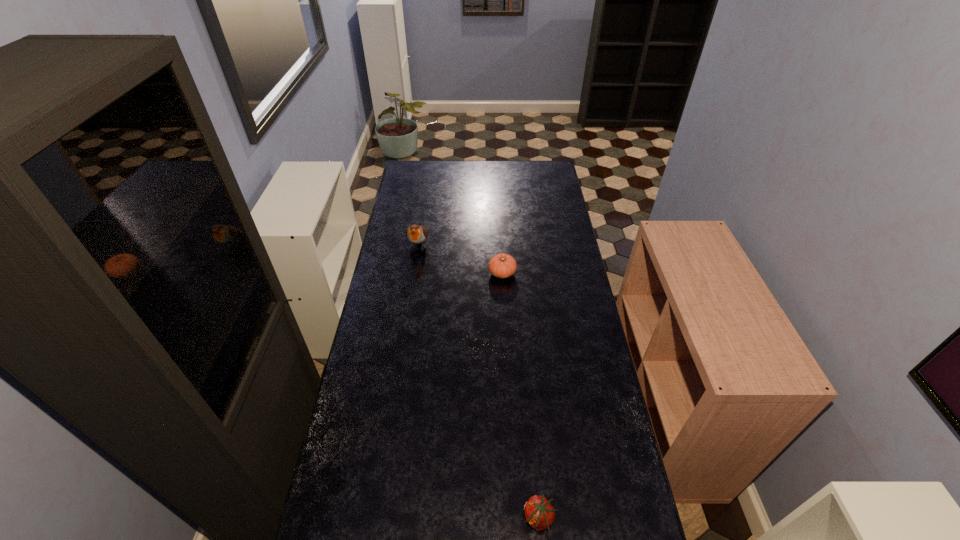
Identify the location of vacant area that lies between the second tallest object and the tallest object. The height and width of the screenshot is (540, 960). pos(461,259).

Where is `empty space between the nearest object and the taller tomato`? This screenshot has width=960, height=540. empty space between the nearest object and the taller tomato is located at coordinates (520, 396).

The width and height of the screenshot is (960, 540). I want to click on free point between the shorter tomato and the second tallest object, so [520, 396].

I want to click on object that is the closest to the farther tomato, so click(416, 234).

You are a GUI agent. You are given a task and a screenshot of the screen. Output one action in this format:
    pyautogui.click(x=<x>, y=<y>)
    Task: Click on the object that is the closest to the tallest object
    
    Given the screenshot: What is the action you would take?
    pyautogui.click(x=502, y=265)

Where is `vacant region that satisfies the following two spatial constraints: 1. at the face of the farthest object; 2. on the left side of the nearer tomato`? The width and height of the screenshot is (960, 540). vacant region that satisfies the following two spatial constraints: 1. at the face of the farthest object; 2. on the left side of the nearer tomato is located at coordinates (376, 518).

Find the location of `vacant space that satisfies the following two spatial constraints: 1. at the face of the bird; 2. on the left side of the farther tomato`. vacant space that satisfies the following two spatial constraints: 1. at the face of the bird; 2. on the left side of the farther tomato is located at coordinates (414, 273).

At what (x,y) coordinates should I click in order to perform the action: click on free space that satisfies the following two spatial constraints: 1. at the face of the nearer tomato; 2. on the right side of the farthest object. Please return your answer as a coordinate pair (x, y). The height and width of the screenshot is (540, 960). Looking at the image, I should click on [x=376, y=518].

Image resolution: width=960 pixels, height=540 pixels. Identify the location of vacant space that satisfies the following two spatial constraints: 1. at the face of the shorter tomato; 2. on the right side of the leftmost object. (376, 518).

The image size is (960, 540). Identify the location of free space that satisfies the following two spatial constraints: 1. at the face of the second shortest object; 2. on the right side of the leftmost object. (414, 273).